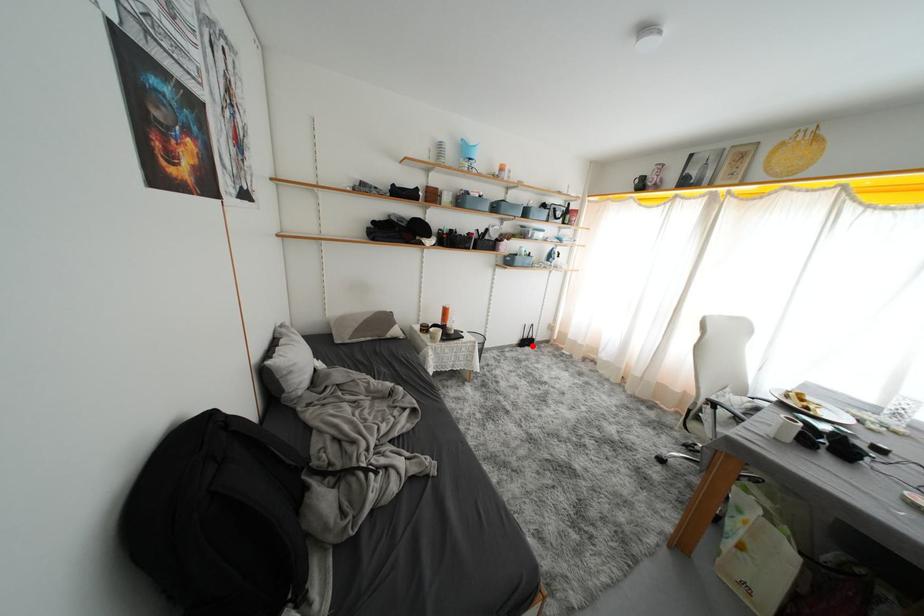
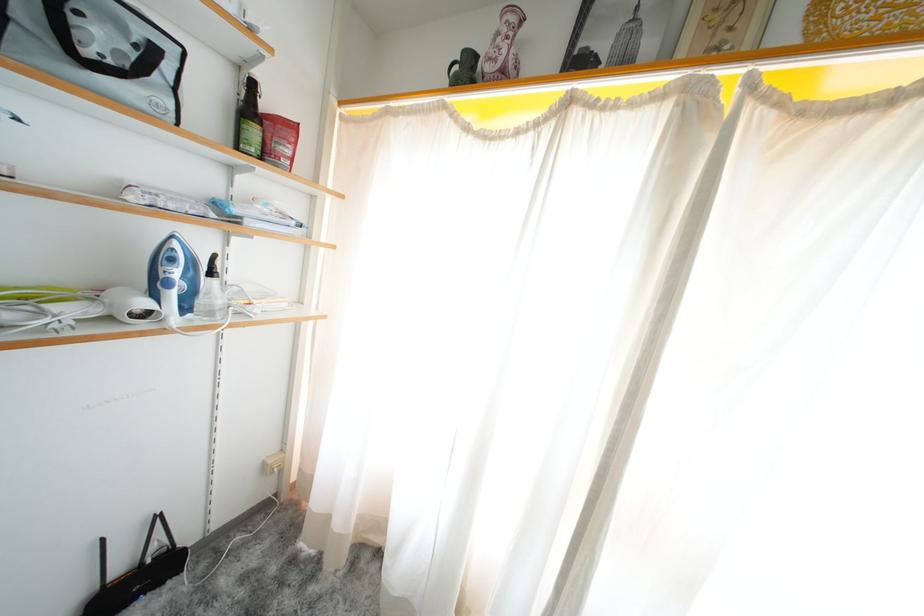
Question: I am providing you with two images of the same scene from different viewpoints. A red point is shown in image1. For the corresponding object point in image2, is it positioned nearer or farther from the camera?

Choices:
 (A) Nearer
 (B) Farther

Answer: (A)